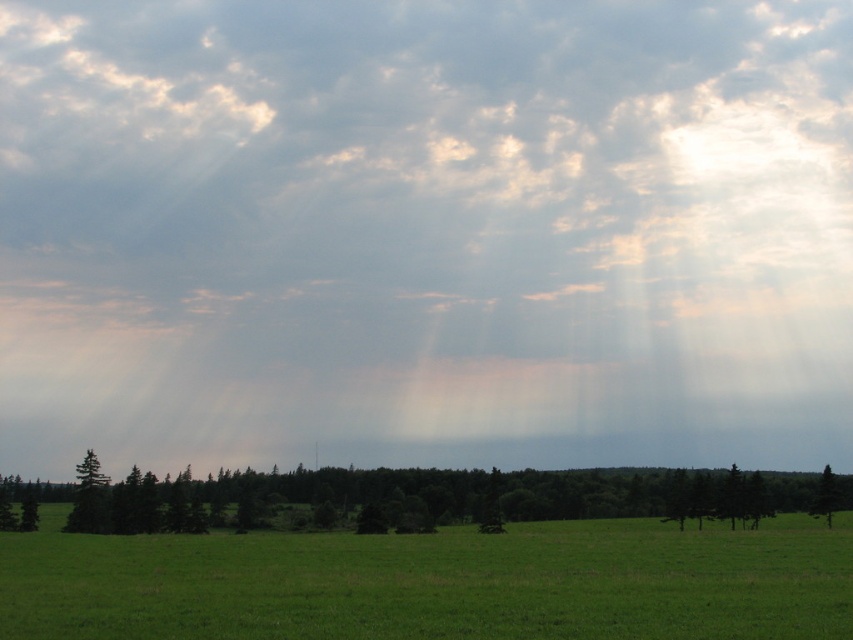
Question: Which object is the closest to the green grassy field at lower center?

Choices:
 (A) green matte tree at lower center
 (B) green matte tree at lower left
 (C) cloudy sky at upper center
 (D) green matte tree at lower right

Answer: (B)

Question: Which object is positioned closest to the green matte tree at lower center?

Choices:
 (A) cloudy sky at upper center
 (B) green grassy field at lower center

Answer: (B)

Question: Considering the relative positions of green grassy field at lower center and green matte tree at lower center in the image provided, where is green grassy field at lower center located with respect to green matte tree at lower center?

Choices:
 (A) left
 (B) right

Answer: (A)

Question: Which object appears farthest from the camera in this image?

Choices:
 (A) green matte tree at lower left
 (B) green matte tree at lower right
 (C) green matte tree at lower center

Answer: (B)

Question: Is cloudy sky at upper center smaller than green matte tree at lower center?

Choices:
 (A) yes
 (B) no

Answer: (B)

Question: Is green matte tree at lower center positioned behind green matte tree at lower right?

Choices:
 (A) yes
 (B) no

Answer: (B)